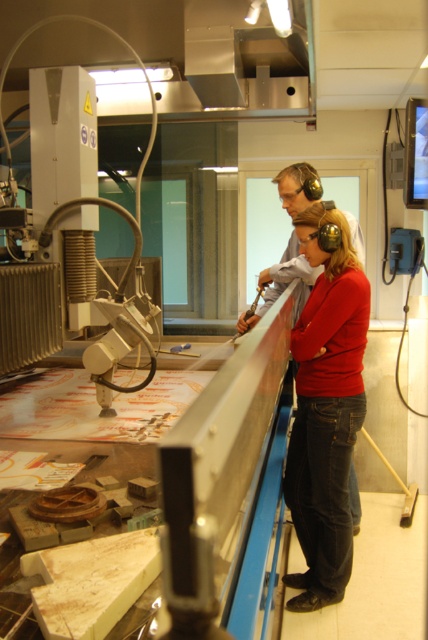
Question: Which point is closer to the camera taking this photo?

Choices:
 (A) (318, 193)
 (B) (315, 260)

Answer: (B)

Question: Is matte red sweater at center further to the viewer compared to matte black headphones at upper center?

Choices:
 (A) no
 (B) yes

Answer: (A)

Question: Among these points, which one is nearest to the camera?

Choices:
 (A) 284,275
 (B) 318,435

Answer: (B)

Question: Is matte red sweater at center to the right of matte black headphones at upper center from the viewer's perspective?

Choices:
 (A) yes
 (B) no

Answer: (B)

Question: Can you confirm if matte red sweater at center is thinner than matte black headphones at upper center?

Choices:
 (A) yes
 (B) no

Answer: (A)